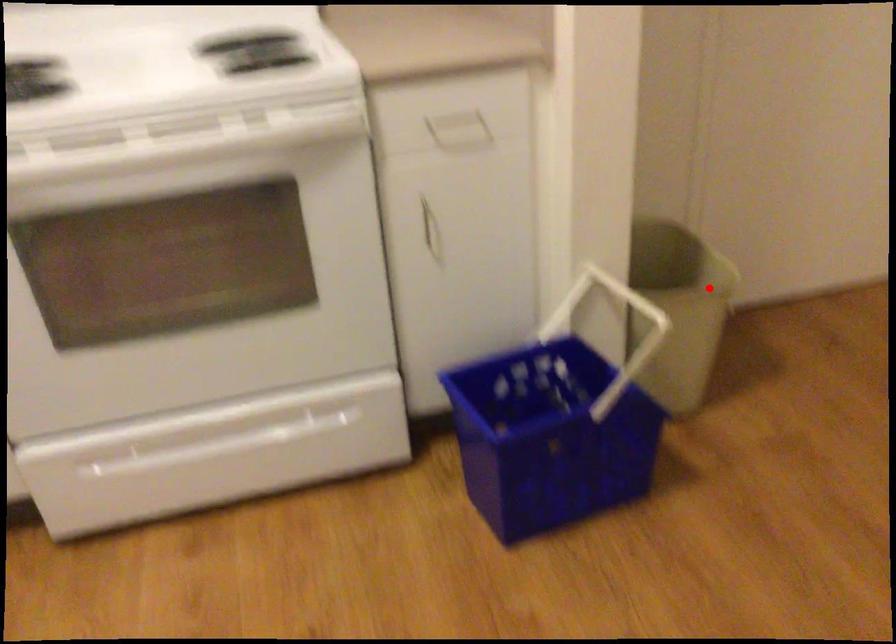
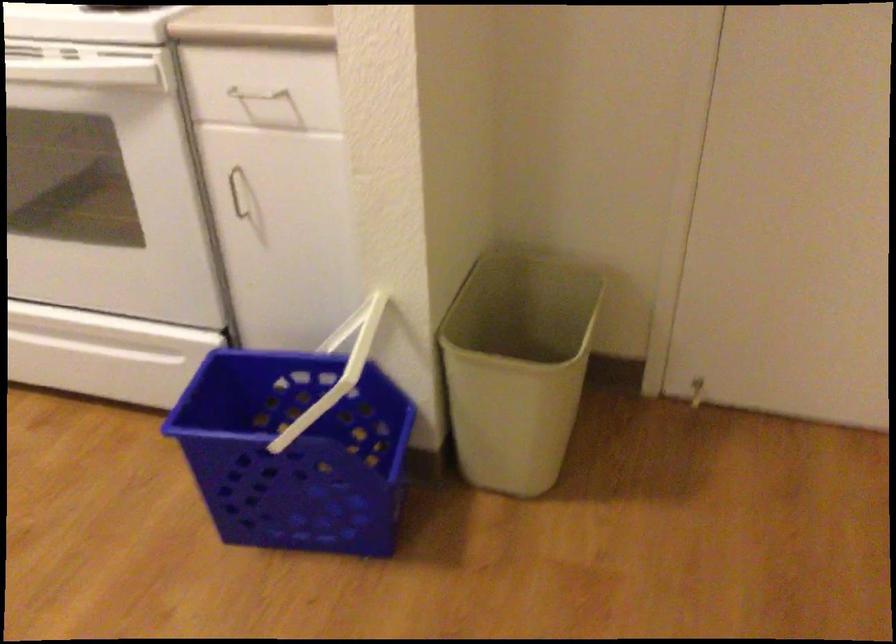
Question: I am providing you with two images of the same scene from different viewpoints. In image1, a red point is highlighted. Considering the same 3D point in image2, which of the following is correct?

Choices:
 (A) It is closer
 (B) It is farther

Answer: (A)